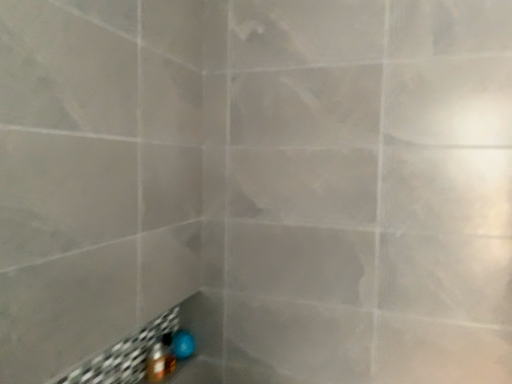
Where is `blue rubber ball at lower left`? The height and width of the screenshot is (384, 512). blue rubber ball at lower left is located at coordinates (182, 344).

Describe the element at coordinates (182, 344) in the screenshot. Image resolution: width=512 pixels, height=384 pixels. I see `blue rubber ball at lower left` at that location.

The image size is (512, 384). Identify the location of blue rubber ball at lower left. (182, 344).